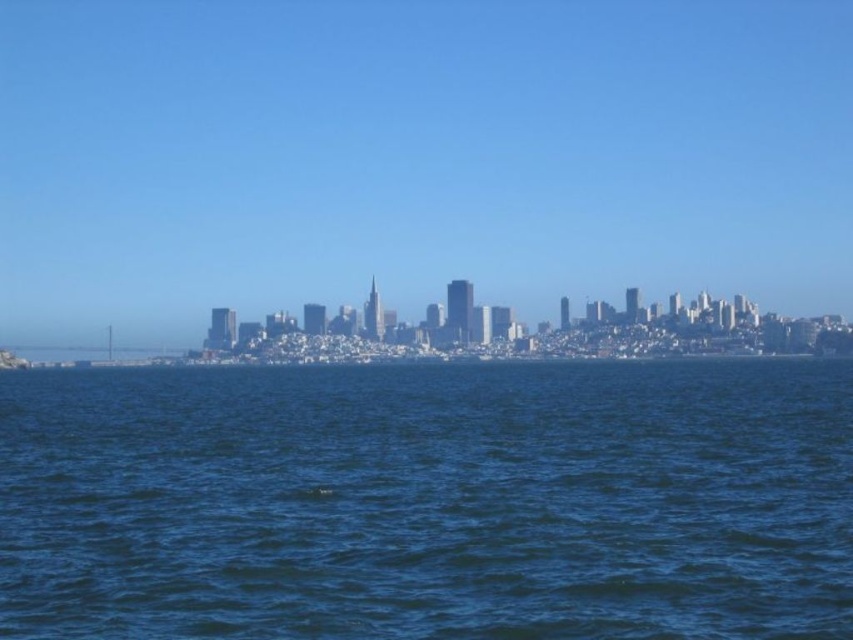
Question: Which point appears farthest from the camera in this image?

Choices:
 (A) (451, 218)
 (B) (578, 572)

Answer: (A)

Question: Which point is closer to the camera?

Choices:
 (A) (421, 195)
 (B) (198, 582)

Answer: (B)

Question: Is transparent glass skyline at center above dark blue water at center?

Choices:
 (A) no
 (B) yes

Answer: (B)

Question: Does transparent glass skyline at center appear under dark blue water at center?

Choices:
 (A) no
 (B) yes

Answer: (A)

Question: Is transparent glass skyline at center positioned before dark blue water at center?

Choices:
 (A) no
 (B) yes

Answer: (A)